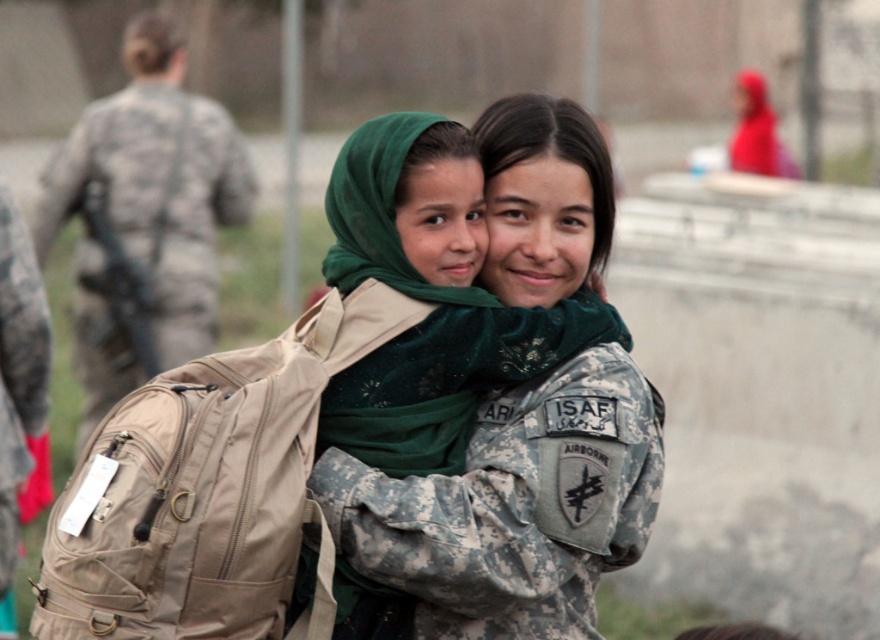
You are a photographer adjusting your camera to focus on two specific points in the image. The first point is at coordinate point (x=620, y=384) and the second is at coordinate point (x=11, y=380). Which point should you focus on first if you want to ensure the closest object is sharp?

Point (x=620, y=384) is closer to the camera than point (x=11, y=380), so focus on point (x=620, y=384) first to ensure the closest object is sharp.

Based on the photo, you are a photographer standing 5 meters away from the camouflage uniform at center. You want to take a photo of the camouflage fabric backpack at left without moving your position. Is the backpack within your camera lens range if the maximum focus distance is 10 meters?

The distance between the camouflage uniform at center and the camouflage fabric backpack at left is 9.92 meters. Since you are 5 meters away from the camouflage uniform at center, the total distance to the backpack would be 5 meters plus 9.92 meters, totaling 14.92 meters. This exceeds the camera lens maximum focus distance of 10 meters, so the backpack is out of range.